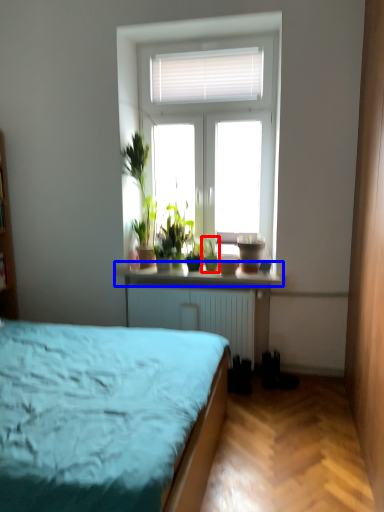
Question: Which point is further to the camera, houseplant (highlighted by a red box) or window sill (highlighted by a blue box)?

Choices:
 (A) houseplant
 (B) window sill

Answer: (A)